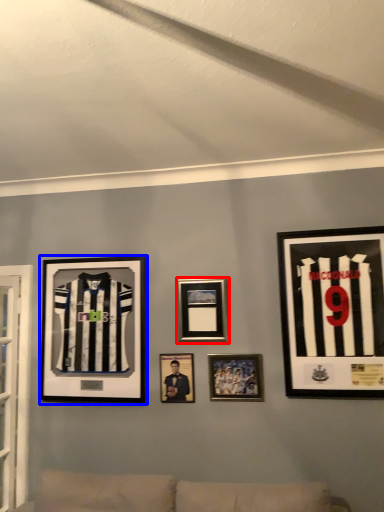
Question: Among these objects, which one is farthest to the camera, picture frame (highlighted by a red box) or picture frame (highlighted by a blue box)?

Choices:
 (A) picture frame
 (B) picture frame

Answer: (B)